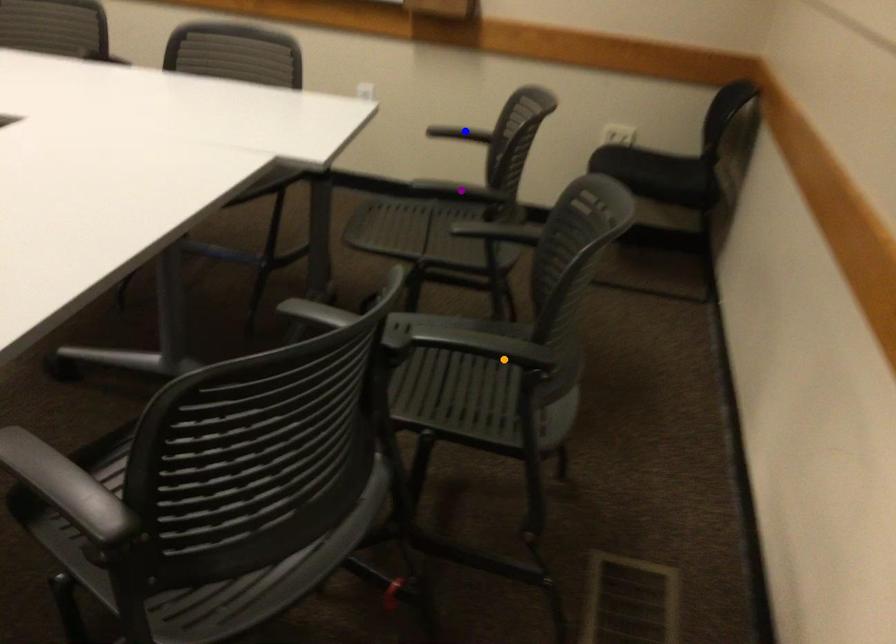
Order these from farthest to nearest:
orange point, blue point, purple point

1. blue point
2. purple point
3. orange point